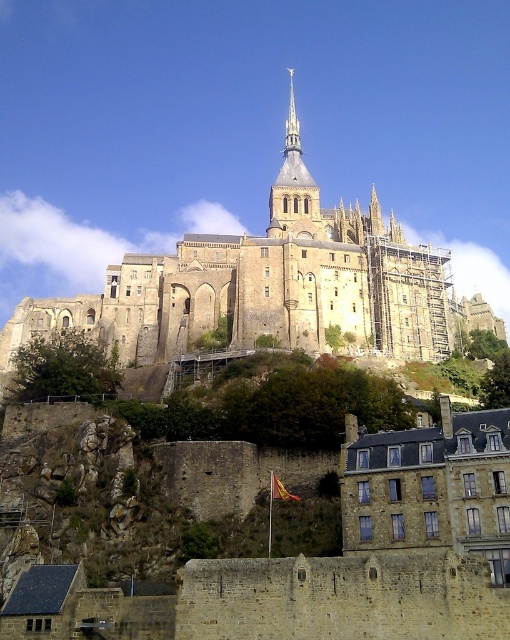
What is located at the coordinates point (271, 289) in the image of the medieval abbey?

The brown stone castle at center is located at point (271, 289).

What are the coordinates of the brown stone castle at center in the image?

The brown stone castle at center is located at coordinates point (x=271, y=289).